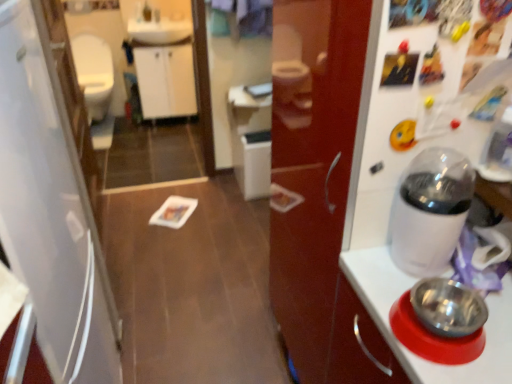
Where is `free spot above white glossy sink at upper center (from a real-world perspective)`? free spot above white glossy sink at upper center (from a real-world perspective) is located at coordinates (156, 26).